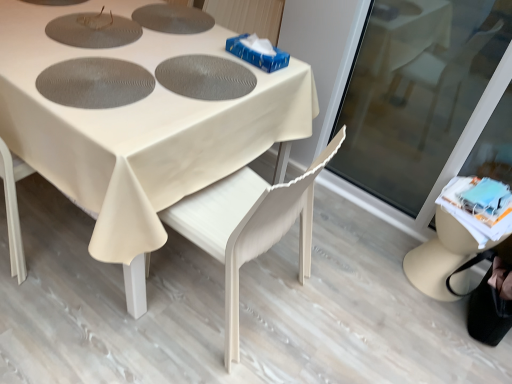
I want to click on vacant space to the right of white wood chair at center, so click(x=342, y=301).